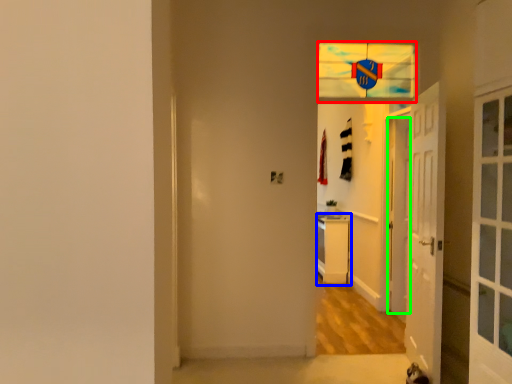
Question: Which is farther away from glass window (highlighted by a red box)? dresser (highlighted by a blue box) or door (highlighted by a green box)?

Choices:
 (A) dresser
 (B) door

Answer: (A)